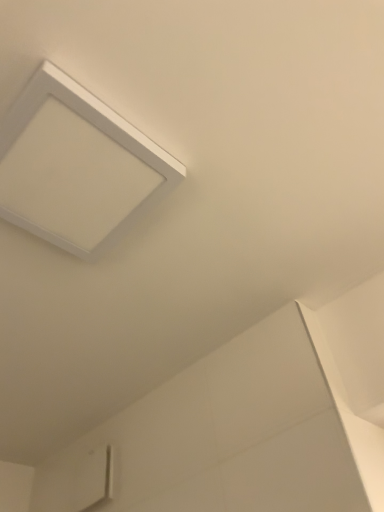
This screenshot has height=512, width=384. What do you see at coordinates (76, 166) in the screenshot?
I see `white glossy window at upper left` at bounding box center [76, 166].

The image size is (384, 512). Identify the location of white glossy window at upper left. (76, 166).

Find the location of a particular element. The height and width of the screenshot is (512, 384). white glossy window at upper left is located at coordinates (x=76, y=166).